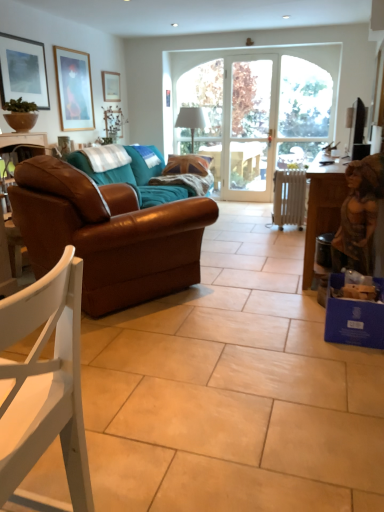
The width and height of the screenshot is (384, 512). Describe the element at coordinates (21, 114) in the screenshot. I see `matte brown bowl at upper left` at that location.

What do you see at coordinates (354, 316) in the screenshot?
I see `blue cardboard box at lower right` at bounding box center [354, 316].

I want to click on wooden table at right, so click(x=322, y=207).

At what (x,y) coordinates should I click in order to perform the action: click on white matte chair at lower left. Please return your answer as a coordinate pair (x, y). The width and height of the screenshot is (384, 512). Looking at the image, I should click on (44, 382).

Based on the photo, does matte black picture frame at upper left, placed as the third picture frame when sorted from right to left, have a larger size compared to brown leather couch at left?

No, matte black picture frame at upper left, placed as the third picture frame when sorted from right to left, is not bigger than brown leather couch at left.

Based on the photo, does matte black picture frame at upper left, placed as the third picture frame when sorted from right to left, appear on the right side of brown leather couch at left?

In fact, matte black picture frame at upper left, placed as the third picture frame when sorted from right to left, is to the left of brown leather couch at left.

Locate an element on the screen. The height and width of the screenshot is (512, 384). studio couch below the matte black picture frame at upper left, marked as the 3th picture frame in a back-to-front arrangement (from the image's perspective) is located at coordinates (108, 234).

From a real-world perspective, is matte black picture frame at upper left, marked as the 3th picture frame in a back-to-front arrangement, positioned over brown leather couch at left based on gravity?

Indeed, from a real-world perspective, matte black picture frame at upper left, marked as the 3th picture frame in a back-to-front arrangement, stands above brown leather couch at left.

In the scene shown: From the image's perspective, is brown leather couch at left located above or below brown leather statue at right?

From the image's perspective, brown leather couch at left appears above brown leather statue at right.

Looking at their sizes, would you say brown leather couch at left is wider or thinner than brown leather statue at right?

Clearly, brown leather couch at left has more width compared to brown leather statue at right.

Is brown leather couch at left bigger or smaller than brown leather statue at right?

Clearly, brown leather couch at left is larger in size than brown leather statue at right.

Which is correct: brown leather couch at left is inside brown leather statue at right, or outside of it?

brown leather couch at left is outside brown leather statue at right.

From the picture: Considering the relative sizes of matte black picture frame at upper left, which is the first picture frame from left to right, and wooden table at right in the image provided, is matte black picture frame at upper left, which is the first picture frame from left to right, smaller than wooden table at right?

Yes.

Considering the points (8, 48) and (320, 206), which point is behind, point (8, 48) or point (320, 206)?

The point (8, 48) is more distant.

Are matte black picture frame at upper left, which is the first picture frame from left to right, and wooden table at right beside each other?

No, matte black picture frame at upper left, which is the first picture frame from left to right, is not touching wooden table at right.

Is matte black picture frame at upper left, marked as the 3th picture frame in a back-to-front arrangement, situated inside wooden table at right or outside?

matte black picture frame at upper left, marked as the 3th picture frame in a back-to-front arrangement, is not inside wooden table at right, it's outside.

Does matte brown bowl at upper left turn towards blue cardboard box at lower right?

Yes, matte brown bowl at upper left is turned towards blue cardboard box at lower right.

In the image, is matte brown bowl at upper left on the left side or the right side of blue cardboard box at lower right?

Clearly, matte brown bowl at upper left is on the left of blue cardboard box at lower right in the image.

Is matte brown bowl at upper left not inside blue cardboard box at lower right?

Yes, matte brown bowl at upper left is outside of blue cardboard box at lower right.

Is there a large distance between matte brown bowl at upper left and blue cardboard box at lower right?

Yes, matte brown bowl at upper left and blue cardboard box at lower right are located far from each other.

From the image's perspective, is brown leather couch at left above wooden picture frame at upper left, the 2th picture frame from the left?

Incorrect, from the image's perspective, brown leather couch at left is lower than wooden picture frame at upper left, the 2th picture frame from the left.

Would you say brown leather couch at left is a long distance from wooden picture frame at upper left, placed as the second picture frame when sorted from front to back?

brown leather couch at left is actually quite close to wooden picture frame at upper left, placed as the second picture frame when sorted from front to back.

Is brown leather couch at left further to the viewer compared to wooden picture frame at upper left, the 2th picture frame from the left?

No, it is not.

From the image's perspective, who appears lower, matte black picture frame at upper left, marked as the 1th picture frame in a front-to-back arrangement, or matte brown bowl at upper left?

matte brown bowl at upper left appears lower in the image.

Based on the photo, is the depth of matte black picture frame at upper left, which is the first picture frame from left to right, greater than that of matte brown bowl at upper left?

Yes, matte black picture frame at upper left, which is the first picture frame from left to right, is behind matte brown bowl at upper left.

Is matte black picture frame at upper left, placed as the third picture frame when sorted from right to left, taller or shorter than matte brown bowl at upper left?

matte black picture frame at upper left, placed as the third picture frame when sorted from right to left, is taller than matte brown bowl at upper left.

Is matte black picture frame at upper left, marked as the 3th picture frame in a back-to-front arrangement, to the right of matte brown bowl at upper left from the viewer's perspective?

Incorrect, matte black picture frame at upper left, marked as the 3th picture frame in a back-to-front arrangement, is not on the right side of matte brown bowl at upper left.

Is wooden picture frame at upper left, the 2th picture frame from the left, not inside matte brown bowl at upper left?

Yes, wooden picture frame at upper left, the 2th picture frame from the left, is located beyond the bounds of matte brown bowl at upper left.

Considering the positions of objects wooden picture frame at upper left, placed as the second picture frame when sorted from front to back, and matte brown bowl at upper left in the image provided, who is more to the right, wooden picture frame at upper left, placed as the second picture frame when sorted from front to back, or matte brown bowl at upper left?

From the viewer's perspective, wooden picture frame at upper left, placed as the second picture frame when sorted from front to back, appears more on the right side.

Consider the image. Can you confirm if wooden picture frame at upper left, which ranks as the 2th picture frame in back-to-front order, is thinner than matte brown bowl at upper left?

Correct, the width of wooden picture frame at upper left, which ranks as the 2th picture frame in back-to-front order, is less than that of matte brown bowl at upper left.

In the image, there is a matte black picture frame at upper left, marked as the 1th picture frame in a front-to-back arrangement. Identify the location of studio couch below it (from the image's perspective). The width and height of the screenshot is (384, 512). (108, 234).

In order to click on couch located underneath the brown leather statue at right (from a real-world perspective) in this screenshot , I will do `click(131, 176)`.

Considering their positions, is wooden picture frame at upper left, which ranks as the 2th picture frame in back-to-front order, positioned further to brown leather couch at left than matte brown bowl at upper left?

matte brown bowl at upper left lies further to brown leather couch at left than the other object.

Based on their spatial positions, is matte brown bowl at upper left or wooden table at right closer to blue cardboard box at lower right?

wooden table at right is closer to blue cardboard box at lower right.

Looking at the image, which one is located further to brown leather couch at left, brown leather statue at right or clear glass door at center?

clear glass door at center is positioned further to the anchor brown leather couch at left.

Which object lies nearer to the anchor point wooden picture frame at upper left, acting as the 2th picture frame starting from the right, white matte chair at lower left or brown leather couch at left?

Among the two, brown leather couch at left is located nearer to wooden picture frame at upper left, acting as the 2th picture frame starting from the right.

Based on their spatial positions, is blue cardboard box at lower right or matte black television at upper right closer to wooden picture frame at upper left, which ranks as the 2th picture frame in back-to-front order?

matte black television at upper right lies closer to wooden picture frame at upper left, which ranks as the 2th picture frame in back-to-front order, than the other object.

Looking at the image, which one is located further to wooden table at right, wooden picture frame at upper left, placed as the second picture frame when sorted from front to back, or brown leather couch at left?

Based on the image, wooden picture frame at upper left, placed as the second picture frame when sorted from front to back, appears to be further to wooden table at right.

Based on their spatial positions, is brown leather statue at right or wooden table at right closer to matte black picture frame at upper left, marked as the 3th picture frame in a back-to-front arrangement?

Among the two, wooden table at right is located nearer to matte black picture frame at upper left, marked as the 3th picture frame in a back-to-front arrangement.

Considering their positions, is wooden picture frame at upper left, the 2th picture frame from the left, positioned further to white metallic radiator at center than matte brown bowl at upper left?

matte brown bowl at upper left lies further to white metallic radiator at center than the other object.

At what (x,y) coordinates should I click in order to perform the action: click on couch between brown leather statue at right and clear glass door at center in the front-back direction. Please return your answer as a coordinate pair (x, y). Looking at the image, I should click on (131, 176).

At what (x,y) coordinates should I click in order to perform the action: click on table located between white matte chair at lower left and clear glass door at center in the depth direction. Please return your answer as a coordinate pair (x, y). The image size is (384, 512). Looking at the image, I should click on (322, 207).

At what (x,y) coordinates should I click in order to perform the action: click on table situated between matte black picture frame at upper left, marked as the 3th picture frame in a back-to-front arrangement, and matte black television at upper right from left to right. Please return your answer as a coordinate pair (x, y). This screenshot has height=512, width=384. Looking at the image, I should click on (322, 207).

This screenshot has width=384, height=512. Find the location of `person located between brown leather couch at left and matte black television at upper right in the left-right direction`. person located between brown leather couch at left and matte black television at upper right in the left-right direction is located at coordinates (359, 215).